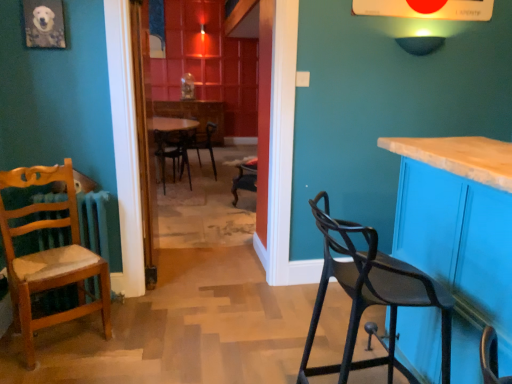
Question: Considering their positions, is black matte bar stool at right, which appears as the fourth chair when viewed from the back, located in front of or behind wooden chair with cushion at left, the 1th chair positioned from the left?

Choices:
 (A) front
 (B) behind

Answer: (A)

Question: Choose the correct answer: Is black matte bar stool at right, which is the first chair from front to back, inside wooden chair with cushion at left, the third chair from the back, or outside it?

Choices:
 (A) inside
 (B) outside

Answer: (B)

Question: Estimate the real-world distances between objects in this image. Which object is closer to the wooden table at center?

Choices:
 (A) matte wood cabinet at right
 (B) wooden table at center
 (C) wooden chair with cushion at left, the third chair from the back
 (D) wooden radiator at left
 (E) black matte chair at center, arranged as the 3th chair when viewed from the right

Answer: (B)

Question: Estimate the real-world distances between objects in this image. Which object is farther from the metallic black chair at center, acting as the 4th chair starting from the front?

Choices:
 (A) wooden table at center
 (B) matte wood cabinet at right
 (C) wooden radiator at left
 (D) black matte chair at center, placed as the 2th chair when sorted from left to right
 (E) wooden door at center

Answer: (B)